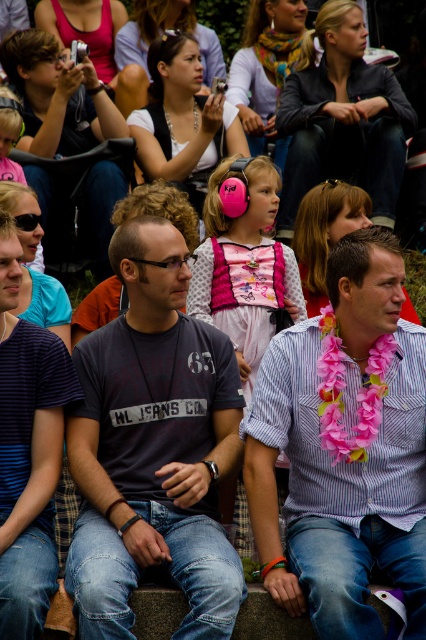
Question: Which of the following is the farthest from the observer?

Choices:
 (A) dark gray t-shirt at center
 (B) pink fabric lei at center

Answer: (B)

Question: Can you confirm if dark gray t-shirt at center is smaller than pink fabric lei at center?

Choices:
 (A) no
 (B) yes

Answer: (B)

Question: Among these points, which one is nearest to the camera?

Choices:
 (A) (112, 476)
 (B) (357, 595)

Answer: (B)

Question: Which point is farther to the camera?

Choices:
 (A) (175, 502)
 (B) (406, 545)

Answer: (A)

Question: Can you confirm if dark gray t-shirt at center is positioned to the left of pink fabric lei at center?

Choices:
 (A) no
 (B) yes

Answer: (B)

Question: Is dark gray t-shirt at center below pink fabric lei at center?

Choices:
 (A) yes
 (B) no

Answer: (A)